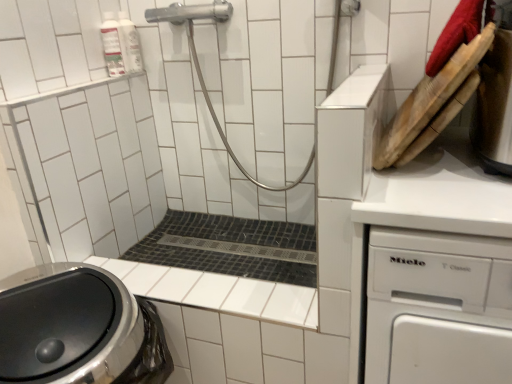
Question: Does white plastic dishwasher at right have a larger size compared to stainless steel kettle at upper right?

Choices:
 (A) yes
 (B) no

Answer: (A)

Question: From a real-world perspective, is white plastic dishwasher at right located higher than stainless steel kettle at upper right?

Choices:
 (A) yes
 (B) no

Answer: (B)

Question: Is white plastic dishwasher at right not near stainless steel kettle at upper right?

Choices:
 (A) no
 (B) yes

Answer: (A)

Question: Does white plastic dishwasher at right have a lesser height compared to stainless steel kettle at upper right?

Choices:
 (A) no
 (B) yes

Answer: (A)

Question: From a real-world perspective, is white plastic dishwasher at right positioned under stainless steel kettle at upper right based on gravity?

Choices:
 (A) no
 (B) yes

Answer: (B)

Question: Is white plastic dishwasher at right taller than stainless steel kettle at upper right?

Choices:
 (A) yes
 (B) no

Answer: (A)

Question: Is black mosaic tile bath at center positioned behind stainless steel kettle at upper right?

Choices:
 (A) no
 (B) yes

Answer: (B)

Question: Is black mosaic tile bath at center facing away from stainless steel kettle at upper right?

Choices:
 (A) yes
 (B) no

Answer: (B)

Question: From a real-world perspective, is black mosaic tile bath at center positioned under stainless steel kettle at upper right based on gravity?

Choices:
 (A) yes
 (B) no

Answer: (A)

Question: Does black mosaic tile bath at center appear on the right side of stainless steel kettle at upper right?

Choices:
 (A) no
 (B) yes

Answer: (A)

Question: Is black mosaic tile bath at center thinner than stainless steel kettle at upper right?

Choices:
 (A) no
 (B) yes

Answer: (B)

Question: Is stainless steel kettle at upper right a part of black mosaic tile bath at center?

Choices:
 (A) yes
 (B) no

Answer: (B)

Question: Does stainless steel kettle at upper right have a greater height compared to white plastic dishwasher at right?

Choices:
 (A) yes
 (B) no

Answer: (B)